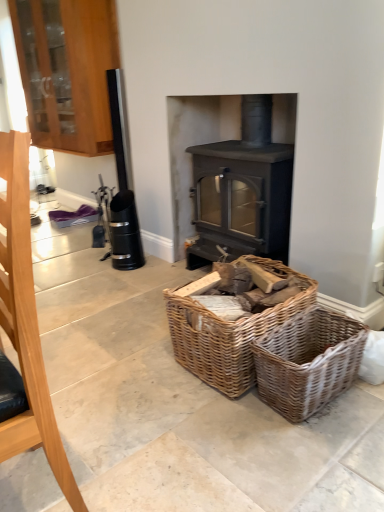
This screenshot has height=512, width=384. I want to click on free space to the left of woven brown basket at lower center, so click(220, 419).